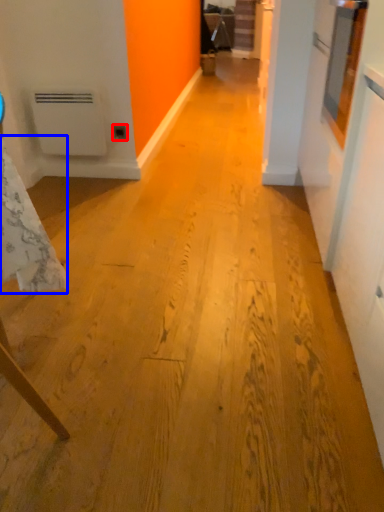
Question: Which point is closer to the camera, electric outlet (highlighted by a red box) or tablecloth (highlighted by a blue box)?

Choices:
 (A) electric outlet
 (B) tablecloth

Answer: (B)